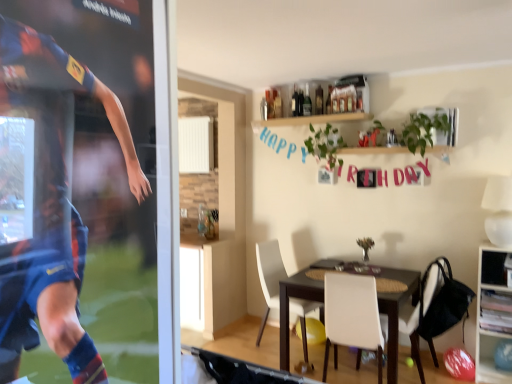
Question: Is the surface of white matte chair at center, which appears as the 2th chair when viewed from the right, in direct contact with dark brown wooden table at center?

Choices:
 (A) yes
 (B) no

Answer: (B)

Question: Can you confirm if white matte chair at center, which appears as the 2th chair when viewed from the right, is positioned to the left of dark brown wooden table at center?

Choices:
 (A) no
 (B) yes

Answer: (B)

Question: From a real-world perspective, is white matte chair at center, which appears as the 2th chair when viewed from the right, on top of dark brown wooden table at center?

Choices:
 (A) yes
 (B) no

Answer: (A)

Question: Does white matte chair at center, which appears as the 2th chair when viewed from the right, have a greater height compared to dark brown wooden table at center?

Choices:
 (A) yes
 (B) no

Answer: (A)

Question: Would you say dark brown wooden table at center is part of white matte chair at center, which appears as the 2th chair when viewed from the right,'s contents?

Choices:
 (A) no
 (B) yes

Answer: (A)

Question: From the image's perspective, is dark brown wooden table at center located above or below white matte chair at center, which appears as the 2th chair when viewed from the right?

Choices:
 (A) above
 (B) below

Answer: (B)

Question: Is point 315,296 positioned closer to the camera than point 342,283?

Choices:
 (A) farther
 (B) closer

Answer: (A)

Question: Is dark brown wooden table at center spatially inside white matte chair at center, which ranks as the 2th chair in left-to-right order, or outside of it?

Choices:
 (A) inside
 (B) outside

Answer: (B)

Question: Considering their positions, is dark brown wooden table at center located in front of or behind white matte chair at center, which appears as the 2th chair when viewed from the right?

Choices:
 (A) front
 (B) behind

Answer: (B)

Question: Is white matte chair at center, which ranks as the 2th chair in left-to-right order, situated inside wooden cabinet at right or outside?

Choices:
 (A) inside
 (B) outside

Answer: (B)

Question: Considering their positions, is white matte chair at center, which appears as the 2th chair when viewed from the right, located in front of or behind wooden cabinet at right?

Choices:
 (A) behind
 (B) front

Answer: (B)

Question: From a real-world perspective, is white matte chair at center, which ranks as the 2th chair in left-to-right order, physically located above or below wooden cabinet at right?

Choices:
 (A) below
 (B) above

Answer: (A)

Question: Is white matte chair at center, which ranks as the 2th chair in left-to-right order, taller or shorter than wooden cabinet at right?

Choices:
 (A) tall
 (B) short

Answer: (B)

Question: Is white matte chair at center, the 3th chair in the right-to-left sequence, inside the boundaries of wooden cabinet at right, or outside?

Choices:
 (A) outside
 (B) inside

Answer: (A)

Question: Is white matte chair at center, placed as the 1th chair when sorted from left to right, bigger or smaller than wooden cabinet at right?

Choices:
 (A) small
 (B) big

Answer: (B)